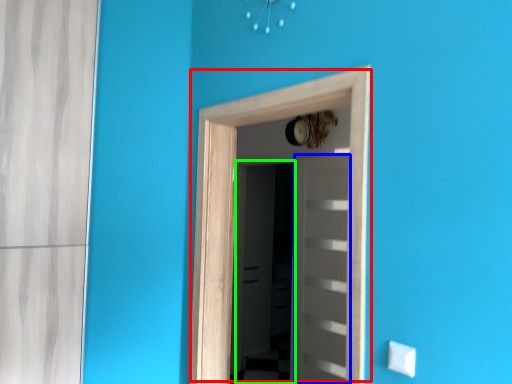
Question: Which object is positioned closest to door (highlighted by a red box)? Select from door (highlighted by a blue box) and screen door (highlighted by a green box).

Choices:
 (A) door
 (B) screen door

Answer: (A)